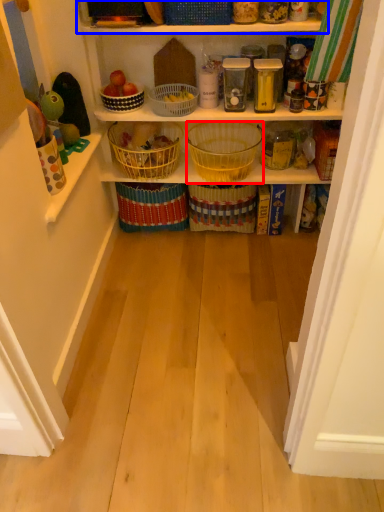
Question: Which object is closer to the camera taking this photo, basket (highlighted by a red box) or shelf (highlighted by a blue box)?

Choices:
 (A) basket
 (B) shelf

Answer: (B)